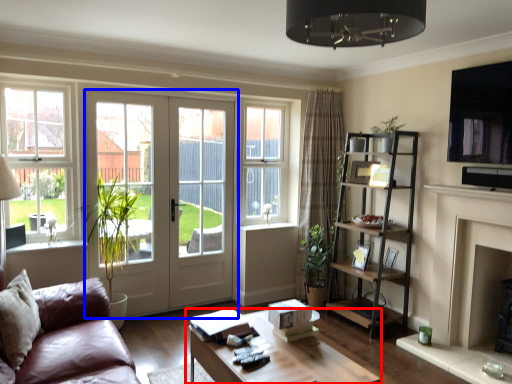
Question: Which point is closer to the camera, coffee table (highlighted by a red box) or door (highlighted by a blue box)?

Choices:
 (A) coffee table
 (B) door

Answer: (A)